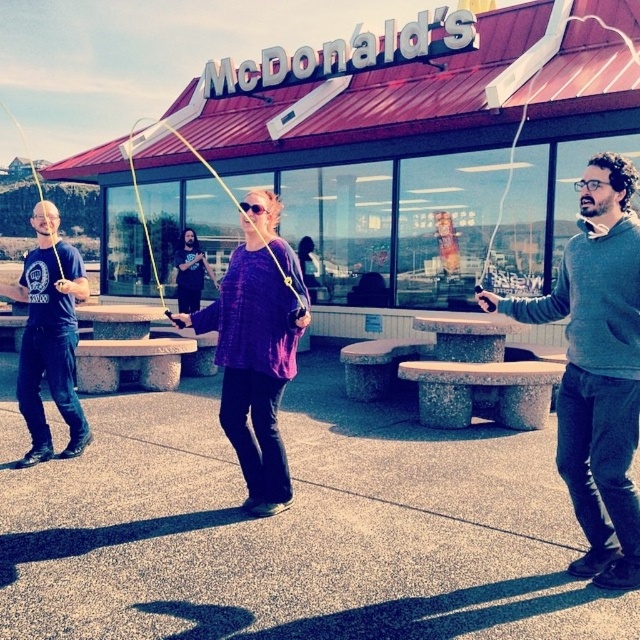
Which is below, gray sweater at right or matte black t-shirt at left?

matte black t-shirt at left is below.

Is gray sweater at right wider than matte black t-shirt at left?

No.

Between point (576, 308) and point (76, 324), which one is positioned behind?

Positioned behind is point (76, 324).

Find the location of a particular element. This screenshot has width=640, height=640. gray sweater at right is located at coordinates (596, 369).

Can you confirm if matte black t-shirt at left is positioned to the right of black matte shirt at center?

No, matte black t-shirt at left is not to the right of black matte shirt at center.

Who is more distant from viewer, (45, 269) or (209, 275)?

Point (209, 275)

Does point (42, 355) come farther from viewer compared to point (196, 296)?

No, (42, 355) is in front of (196, 296).

Identify the location of matte black t-shirt at left. (49, 336).

Does purple woven sweater at center come behind matte black t-shirt at left?

No, it is not.

Who is more forward, (221, 372) or (36, 340)?

Point (36, 340) is more forward.

Locate an element on the screen. This screenshot has width=640, height=640. purple woven sweater at center is located at coordinates (256, 349).

Locate an element on the screen. This screenshot has width=640, height=640. purple woven sweater at center is located at coordinates (256, 349).